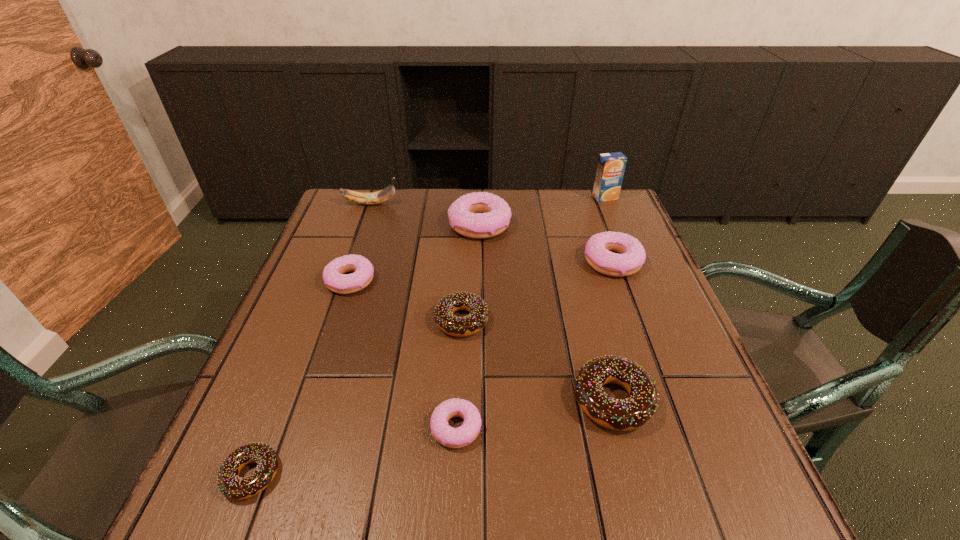
Locate an element on the screen. The image size is (960, 540). free point at the near right corner is located at coordinates (724, 500).

Identify the location of blank region between the third biggest purple doughnut and the fourth farthest doughnut. (406, 300).

You are a GUI agent. You are given a task and a screenshot of the screen. Output one action in this format:
    pyautogui.click(x=<x>, y=<y>)
    Task: Click on the vacant space that's between the rightmost purple doughnut and the second biggest chocolate doughnut
    
    Given the screenshot: What is the action you would take?
    pyautogui.click(x=537, y=291)

This screenshot has height=540, width=960. I want to click on free space between the seventh shortest object and the smallest chocolate doughnut, so click(366, 350).

At what (x,y) coordinates should I click in order to perform the action: click on vacant point located between the tallest doughnut and the biggest chocolate doughnut. Please return your answer as a coordinate pair (x, y). Looking at the image, I should click on (547, 312).

The image size is (960, 540). I want to click on vacant space that is in between the second nearest chocolate doughnut and the fourth farthest doughnut, so click(x=538, y=360).

The image size is (960, 540). Identify the location of free point between the second biggest purple doughnut and the third biggest purple doughnut. (481, 271).

Where is `vacant area between the farthest chocolate doughnut and the rightmost purple doughnut`? vacant area between the farthest chocolate doughnut and the rightmost purple doughnut is located at coordinates (537, 291).

Where is `free area in between the second farthest chocolate doughnut and the nearest purple doughnut`? The image size is (960, 540). free area in between the second farthest chocolate doughnut and the nearest purple doughnut is located at coordinates (534, 414).

You are a GUI agent. You are given a task and a screenshot of the screen. Output one action in this format:
    pyautogui.click(x=<x>, y=<y>)
    Task: Click on the free space that is in between the smallest purple doughnut and the second nearest chocolate doughnut
    This screenshot has width=960, height=540.
    Given the screenshot: What is the action you would take?
    pyautogui.click(x=534, y=414)